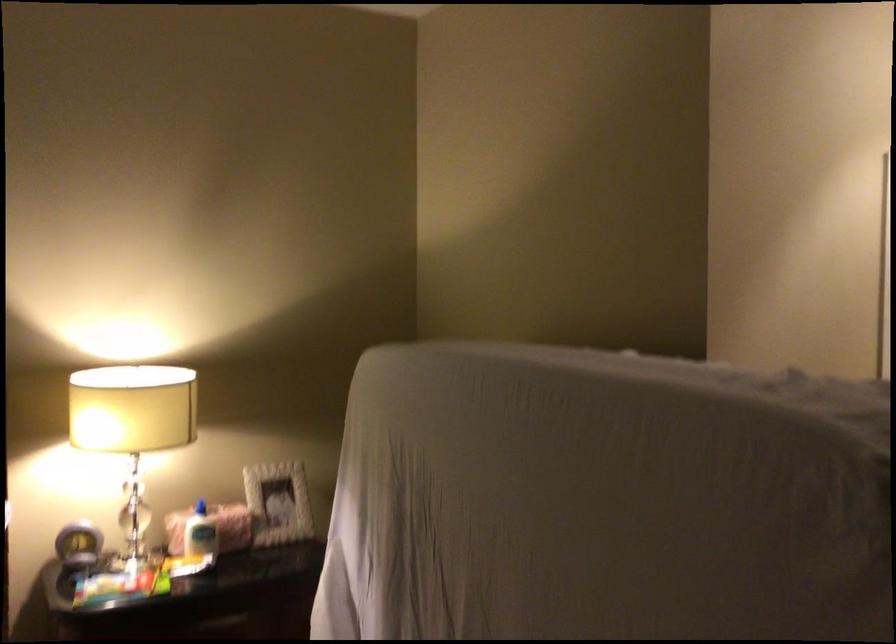
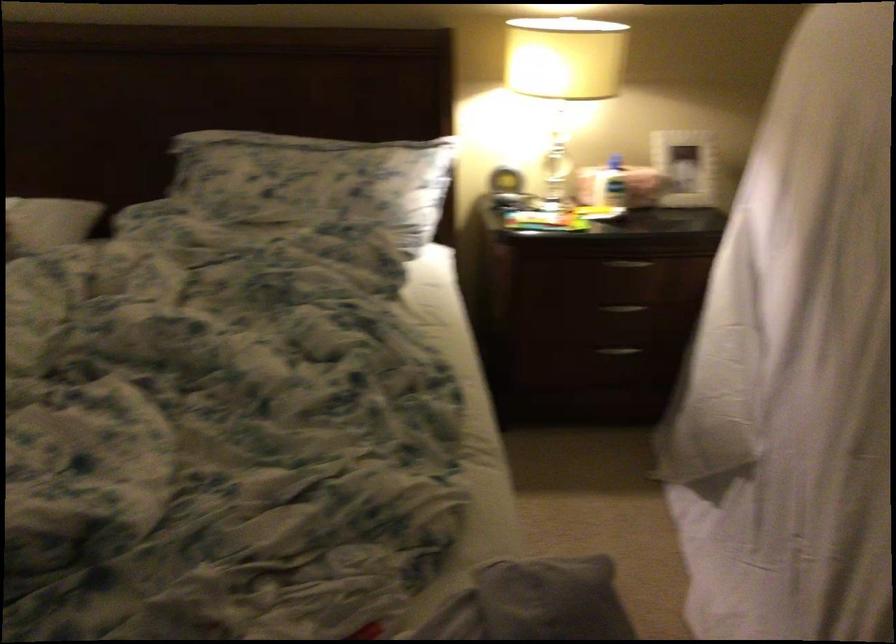
Where in the second image is the point corresponding to pixel 274 506 from the first image?

(684, 167)